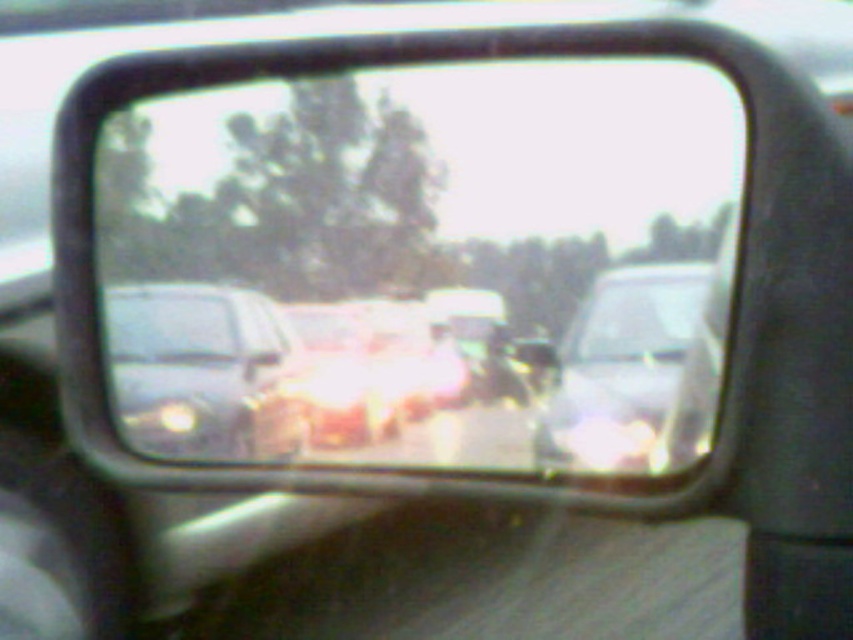
You are a driver checking your side mirror and notice the clear glass mirror at center and the satin silver sedan at center. Which object takes up more space in your view?

The clear glass mirror at center is larger in size than the satin silver sedan at center, so it takes up more space in your view.

You are a passenger in a car and notice the clear glass mirror at center and the satin silver sedan at center through the window. Which object is positioned more to the left from your viewpoint?

The clear glass mirror at center is positioned to the left of the satin silver sedan at center, so it is more to the left.